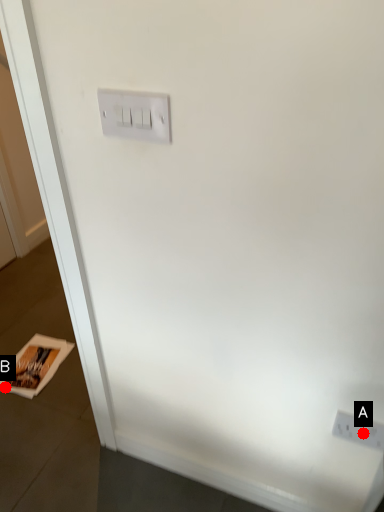
Question: Two points are circled on the image, labeled by A and B beside each circle. Among these points, which one is farthest from the camera?

Choices:
 (A) A is further
 (B) B is further

Answer: (B)